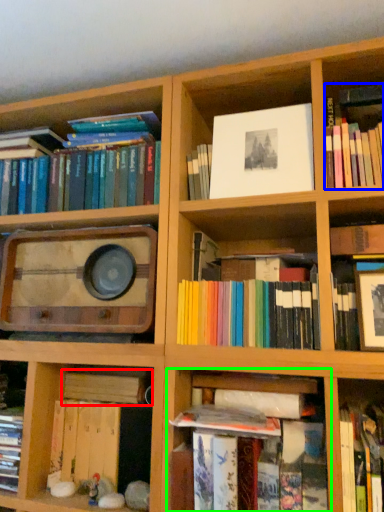
Question: Which object is the closest to the book (highlighted by a red box)? Choose among these: book (highlighted by a blue box) or shelf (highlighted by a green box).

Choices:
 (A) book
 (B) shelf

Answer: (B)